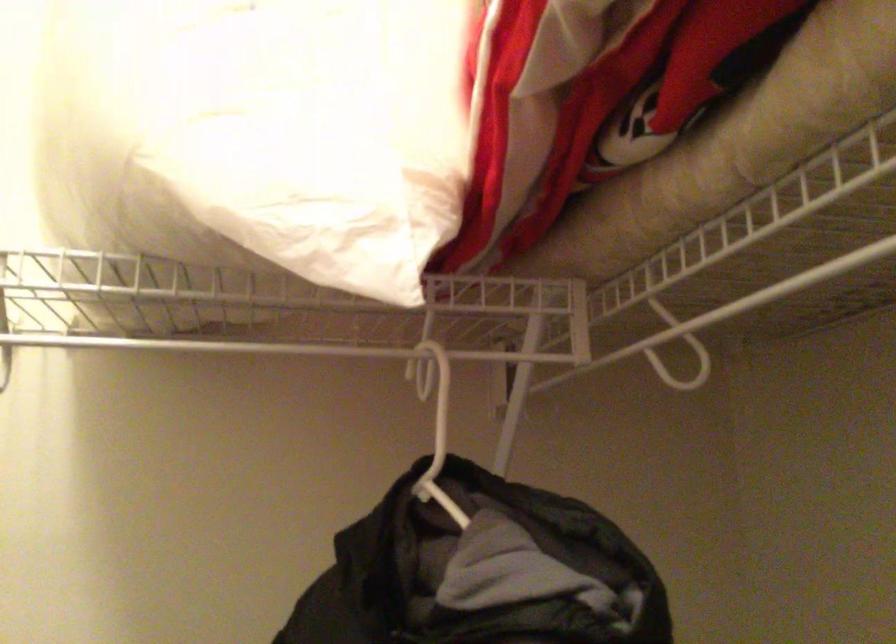
What do you see at coordinates (436, 404) in the screenshot? I see `a white hanger hook` at bounding box center [436, 404].